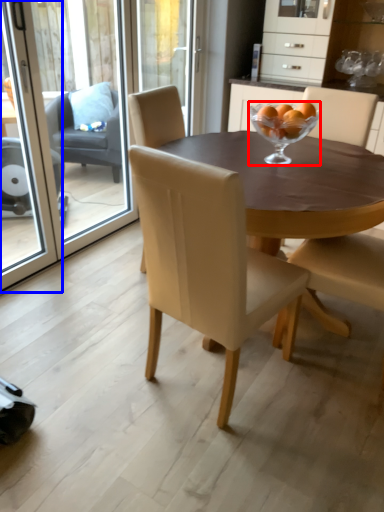
Question: Which object is closer to the camera taking this photo, martini glass (highlighted by a red box) or screen door (highlighted by a blue box)?

Choices:
 (A) martini glass
 (B) screen door

Answer: (B)